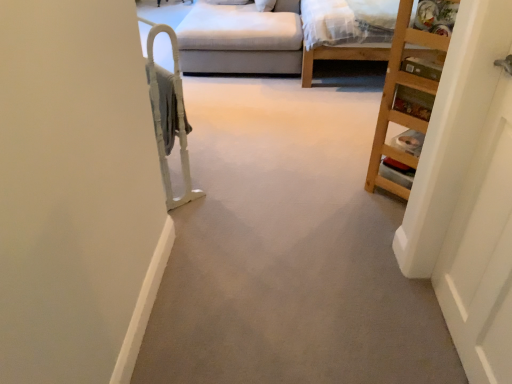
Question: Does white wooden door at right have a greater width compared to white plastic bunk bed at left?

Choices:
 (A) yes
 (B) no

Answer: (B)

Question: Considering the relative sizes of white wooden door at right and white plastic bunk bed at left in the image provided, is white wooden door at right thinner than white plastic bunk bed at left?

Choices:
 (A) no
 (B) yes

Answer: (B)

Question: Is white wooden door at right behind white plastic bunk bed at left?

Choices:
 (A) yes
 (B) no

Answer: (B)

Question: Is white wooden door at right bigger than white plastic bunk bed at left?

Choices:
 (A) yes
 (B) no

Answer: (B)

Question: Does white wooden door at right have a smaller size compared to white plastic bunk bed at left?

Choices:
 (A) yes
 (B) no

Answer: (A)

Question: In the image, is light beige fabric couch at upper center positioned in front of or behind white plastic bunk bed at left?

Choices:
 (A) behind
 (B) front

Answer: (A)

Question: From a real-world perspective, is light beige fabric couch at upper center positioned above or below white plastic bunk bed at left?

Choices:
 (A) below
 (B) above

Answer: (A)

Question: Is light beige fabric couch at upper center wider or thinner than white plastic bunk bed at left?

Choices:
 (A) thin
 (B) wide

Answer: (B)

Question: Is light beige fabric couch at upper center spatially inside white plastic bunk bed at left, or outside of it?

Choices:
 (A) inside
 (B) outside

Answer: (B)

Question: Considering their positions, is wooden bookshelf at right located in front of or behind white wooden door at right?

Choices:
 (A) behind
 (B) front

Answer: (A)

Question: In terms of width, does wooden bookshelf at right look wider or thinner when compared to white wooden door at right?

Choices:
 (A) wide
 (B) thin

Answer: (A)

Question: Considering the relative positions of wooden bookshelf at right and white wooden door at right in the image provided, is wooden bookshelf at right to the left or to the right of white wooden door at right?

Choices:
 (A) left
 (B) right

Answer: (B)

Question: Is wooden bookshelf at right inside or outside of white wooden door at right?

Choices:
 (A) inside
 (B) outside

Answer: (B)

Question: Relative to wooden bed frame at upper right, is white plastic bunk bed at left in front or behind?

Choices:
 (A) front
 (B) behind

Answer: (A)

Question: Does point (181, 87) appear closer or farther from the camera than point (367, 51)?

Choices:
 (A) closer
 (B) farther

Answer: (A)